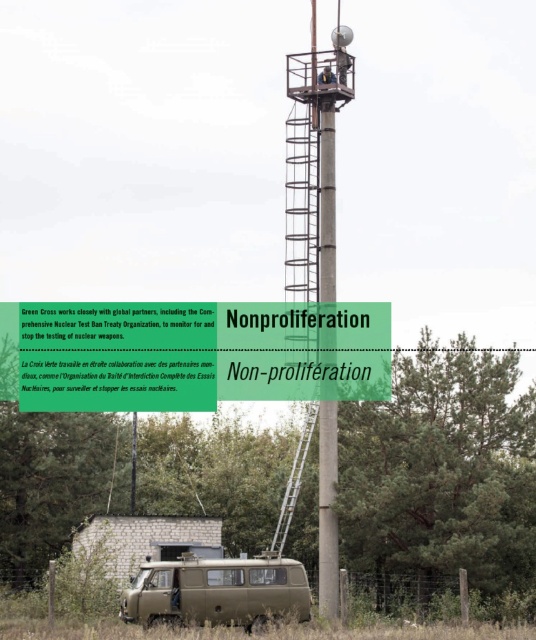
You are standing at the base of the observation tower and want to reach the top platform. You notice two points marked on the tower structure. Which point is closer to you, point (304, 195) or point (321, 296)?

Point (304, 195) is closer to you because it is further to the viewer than point (321, 296).